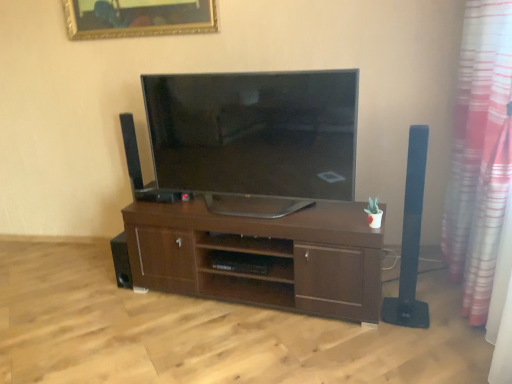
Locate an element on the screen. vacant position to the left of pink striped curtain at right is located at coordinates (356, 342).